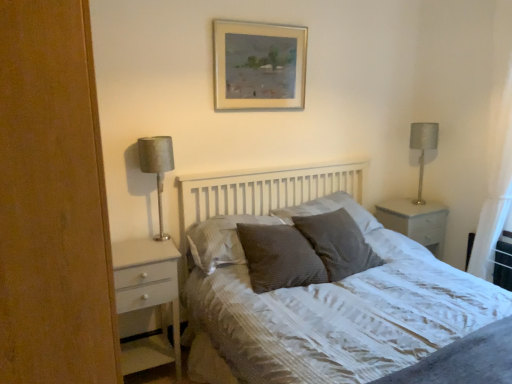
Where is `free spot above satin brown pillow at center, the fourth pillow when ordered from right to left (from a real-world perspective)`? This screenshot has width=512, height=384. free spot above satin brown pillow at center, the fourth pillow when ordered from right to left (from a real-world perspective) is located at coordinates pos(252,225).